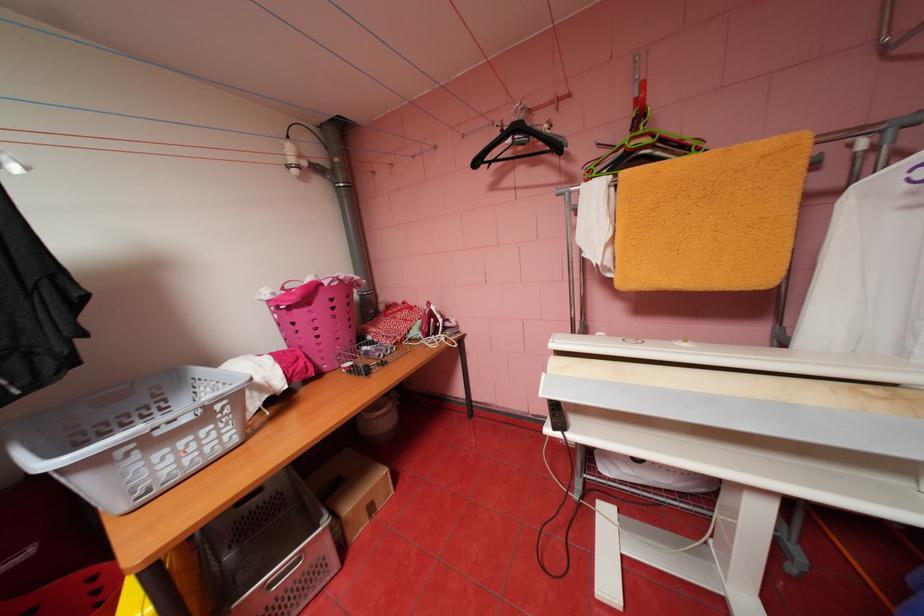
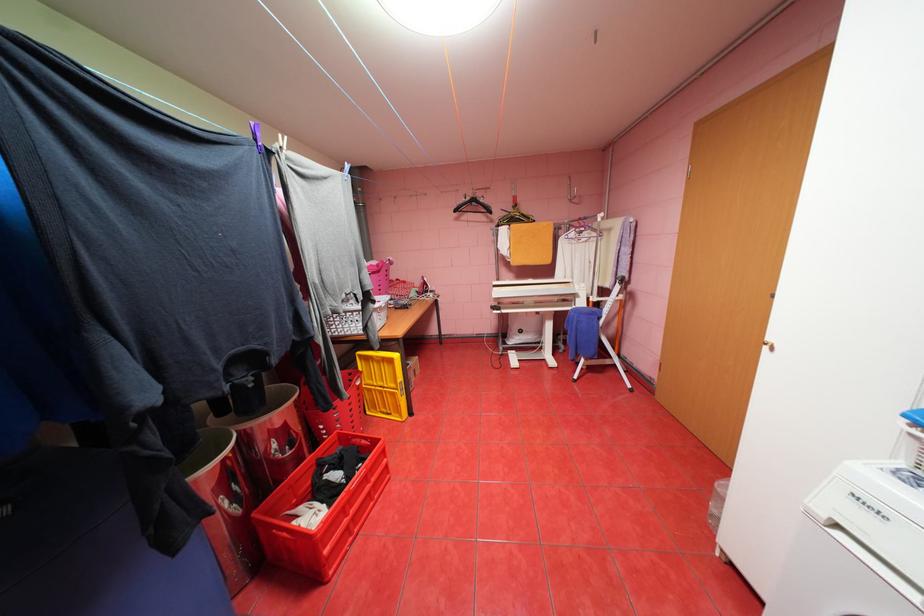
The point at (580, 179) is marked in the first image. Where is the corresponding point in the second image?

(500, 221)